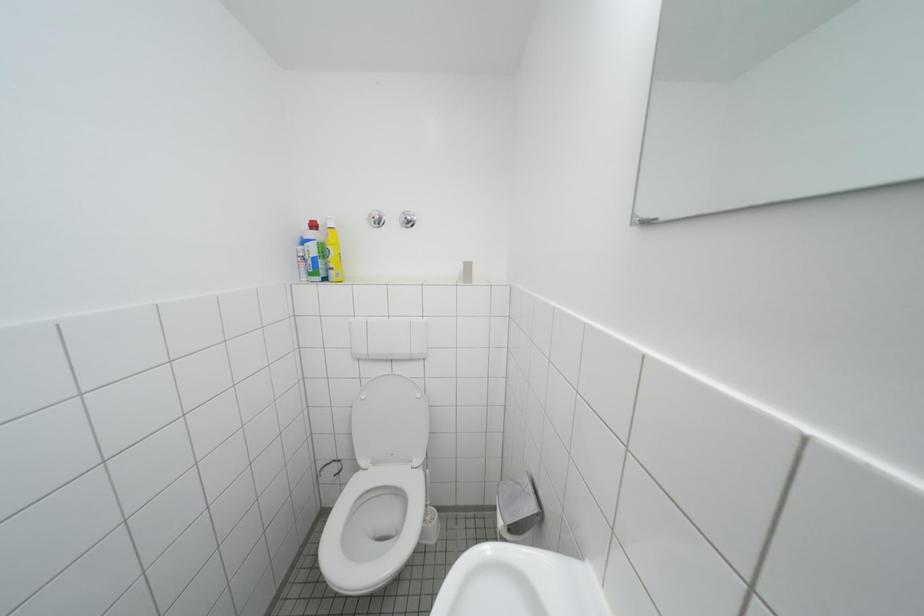
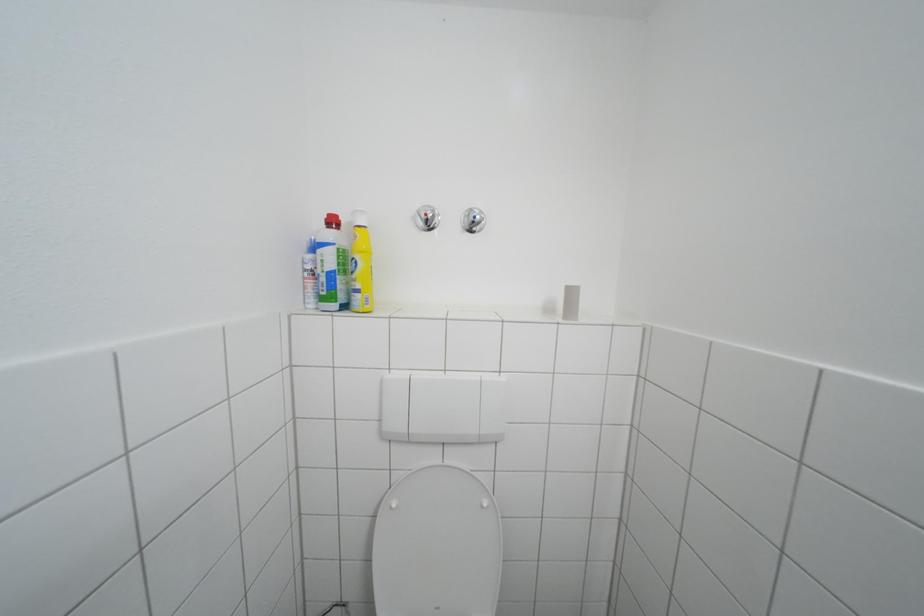
Question: The first image is from the beginning of the video and the second image is from the end. How did the camera likely rotate when shooting the video?

Choices:
 (A) Left
 (B) Right
 (C) Up
 (D) Down

Answer: (C)